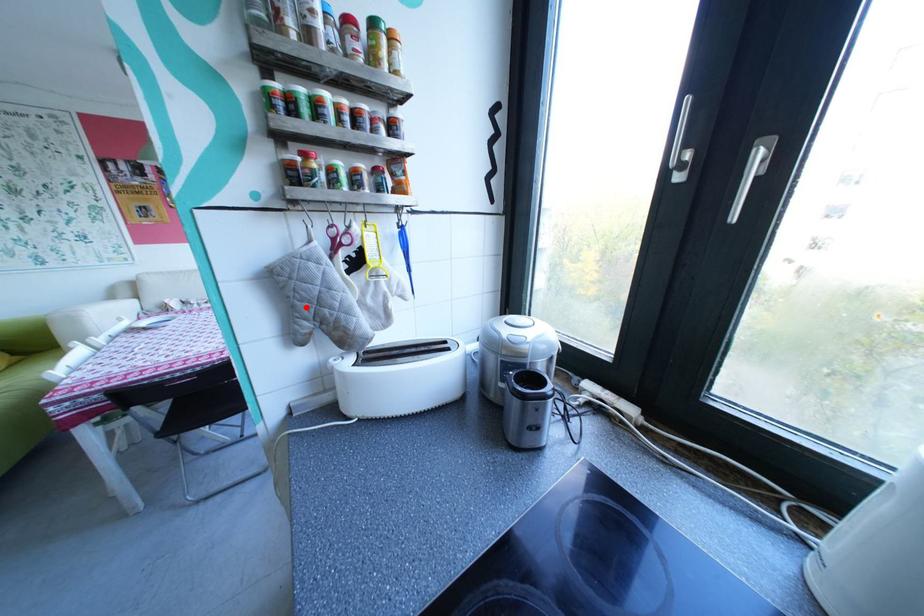
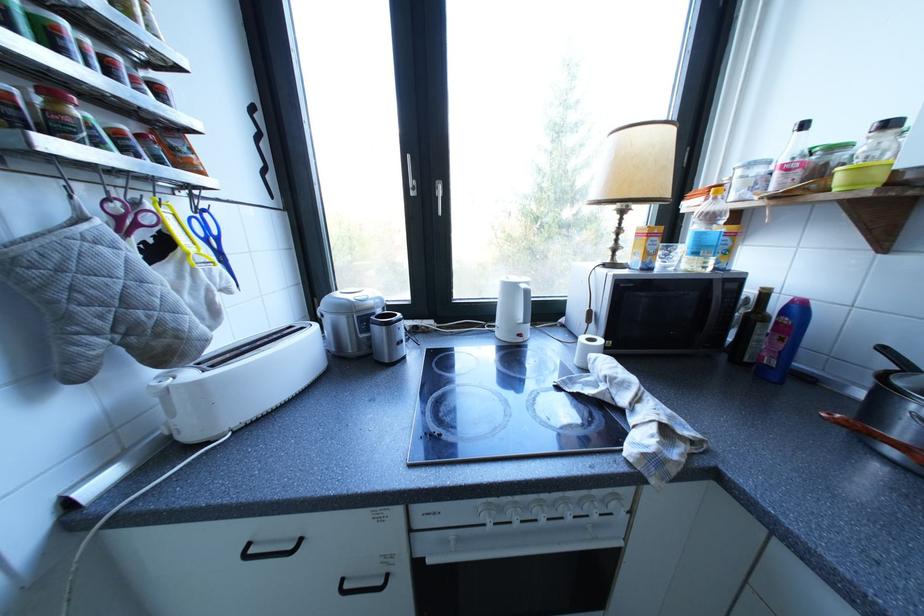
The point at the highlighted location is marked in the first image. Where is the corresponding point in the second image?

(79, 318)